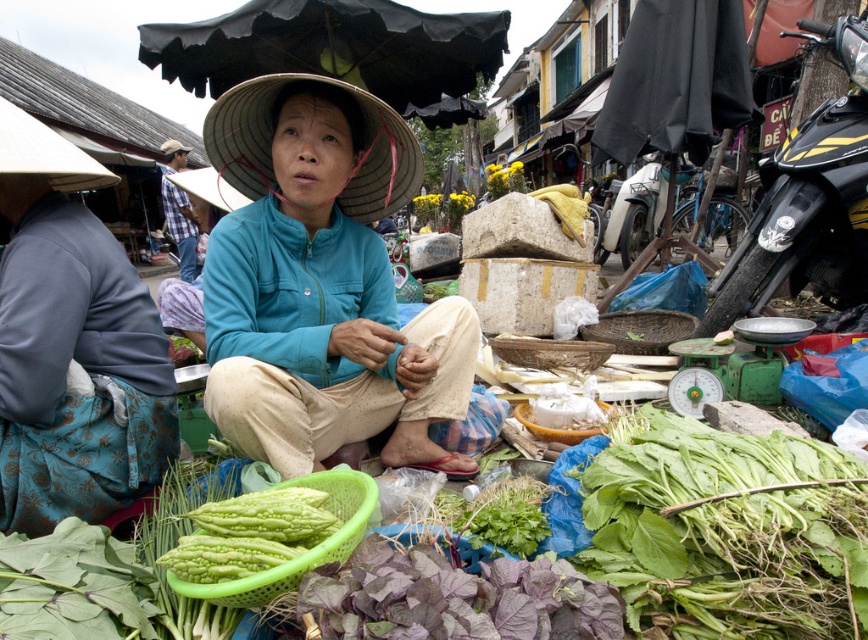
You are a customer at the market and want to pick up the green leafy at center. Which direction should you move relative to the woven straw hat at center?

The green leafy at center is to the right of the woven straw hat at center, so you should move to the right of the woven straw hat at center to pick it up.

You are a customer at this market and want to buy both the woven straw hat at center and the green matte vegetable at lower left. Which item is bigger in size?

The woven straw hat at center has a larger size compared to the green matte vegetable at lower left.

You are standing in the street market and want to take a photo of both the point at coordinates (258, 280) and the point at coordinates (707, 109). To ensure both points are in focus, which point should you focus on first?

You should focus on point (258, 280) first because it is closer to the viewer than point (707, 109), ensuring both are in focus when using depth of field.